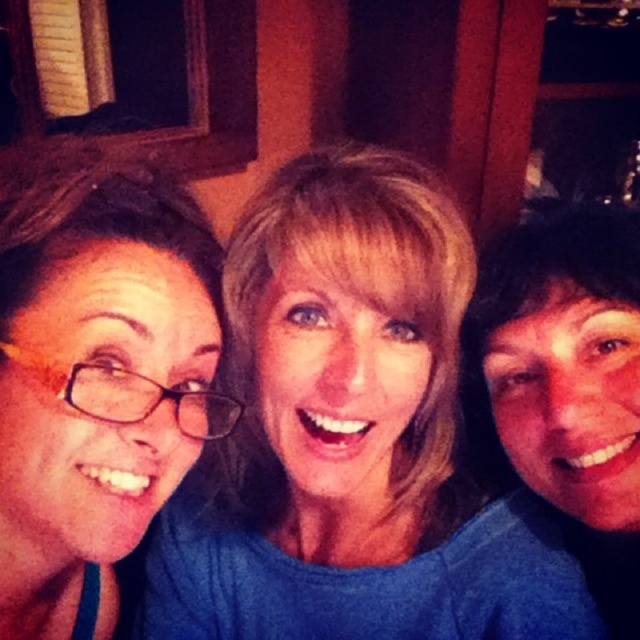
You are a photographer trying to adjust the lighting for a group photo. You notice two shirts at the center of the image, a blue fabric shirt at center and a matte blue shirt at center. Which shirt is closer to the light source in the room?

The blue fabric shirt at center is 5.71 inches away from the matte blue shirt at center. Since the blue fabric shirt is closer to the light source, it would receive more direct light compared to the matte blue shirt at center.